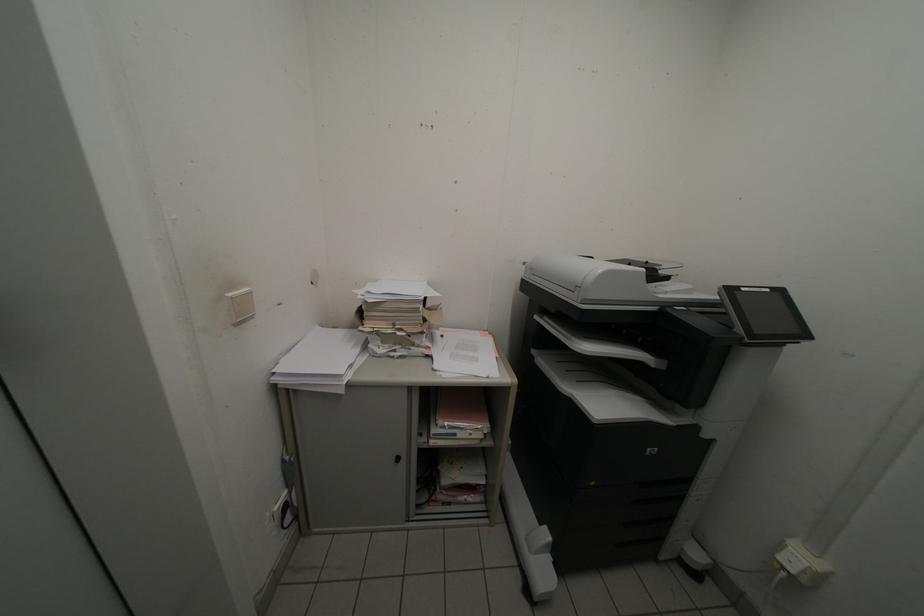
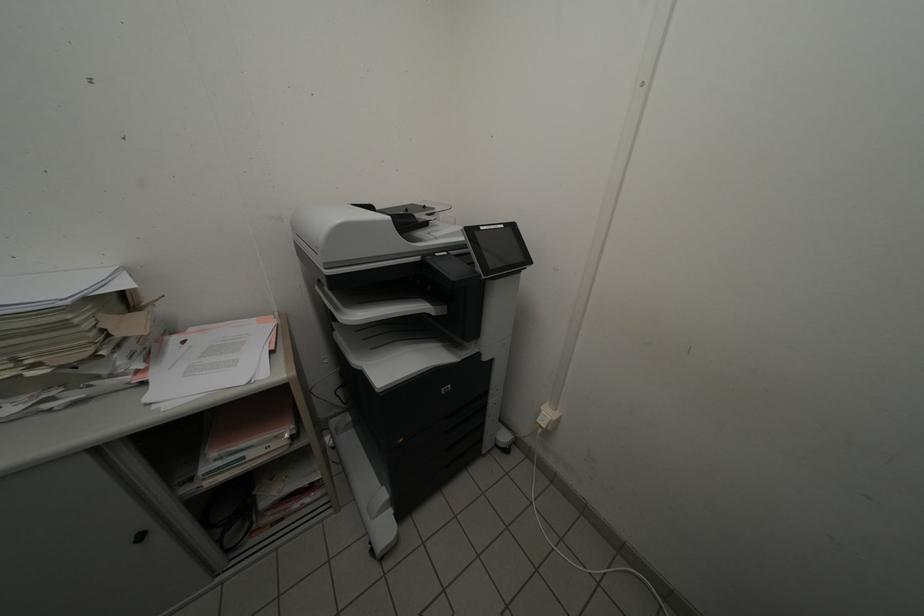
The point at (579,397) is marked in the first image. Where is the corresponding point in the second image?

(370, 369)